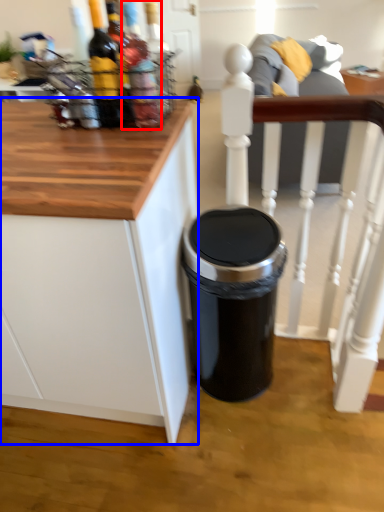
Question: Among these objects, which one is nearest to the camera, bottle (highlighted by a red box) or cabinetry (highlighted by a blue box)?

Choices:
 (A) bottle
 (B) cabinetry

Answer: (B)